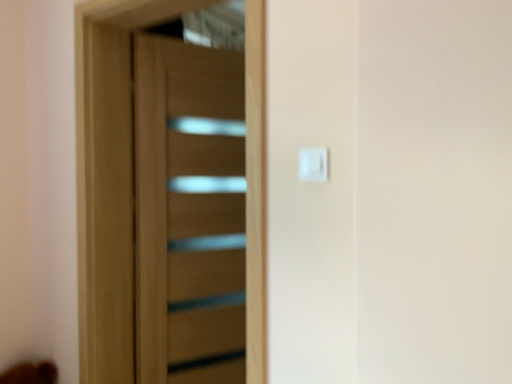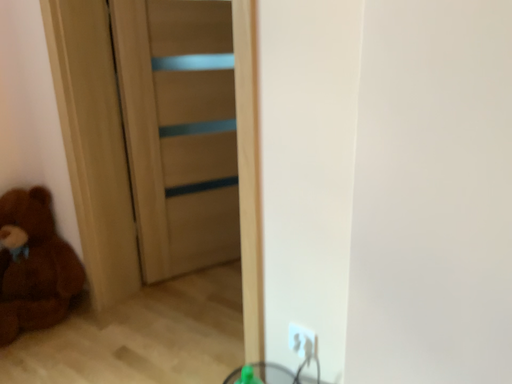
Question: Which way did the camera rotate in the video?

Choices:
 (A) rotated downward
 (B) rotated upward

Answer: (A)